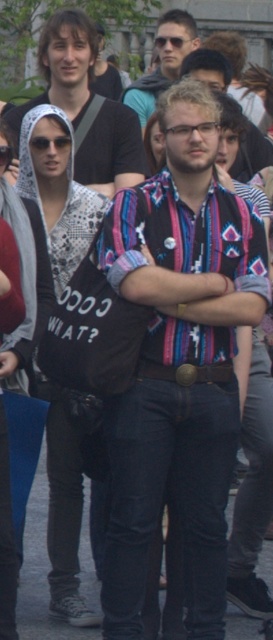
Based on the photo, you are a photographer trying to capture the scene. You notice two people wearing matte black shirts. Which one is positioned closer to you, the matte black shirt at upper left or the matte black shirt at center?

The matte black shirt at upper left is closer to the viewer than the matte black shirt at center.